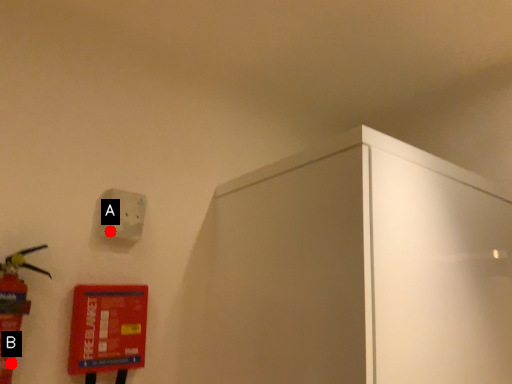
Question: Two points are circled on the image, labeled by A and B beside each circle. Which point is closer to the camera taking this photo?

Choices:
 (A) A is closer
 (B) B is closer

Answer: (B)